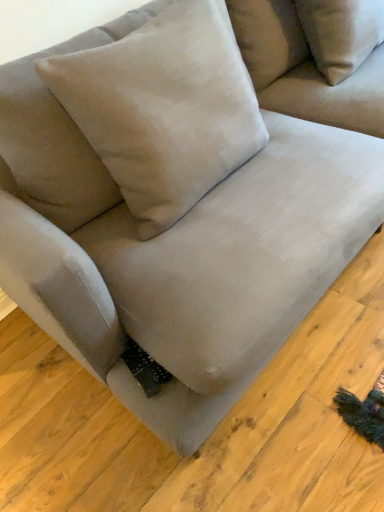
Measure the distance between point (160, 116) and camera.

1.09 meters.

This screenshot has height=512, width=384. What do you see at coordinates (164, 109) in the screenshot?
I see `velvet beige pillow at center` at bounding box center [164, 109].

In order to click on velvet beige pillow at center in this screenshot , I will do `click(164, 109)`.

What is the approximate height of suede-like beige couch at upper right?

17.20 inches.

The image size is (384, 512). What do you see at coordinates (304, 70) in the screenshot? I see `suede-like beige couch at upper right` at bounding box center [304, 70].

Locate an element on the screen. This screenshot has height=512, width=384. suede-like beige couch at upper right is located at coordinates (304, 70).

Find the location of a particular element. velvet beige pillow at center is located at coordinates (164, 109).

Considering the relative positions of suede-like beige couch at upper right and velvet beige pillow at center in the image provided, is suede-like beige couch at upper right to the left or to the right of velvet beige pillow at center?

Clearly, suede-like beige couch at upper right is on the right of velvet beige pillow at center in the image.

Who is more distant, suede-like beige couch at upper right or velvet beige pillow at center?

Positioned behind is suede-like beige couch at upper right.

Between point (314, 71) and point (199, 13), which one is positioned in front?

The point (199, 13) is more forward.

From the image's perspective, between suede-like beige couch at upper right and velvet beige pillow at center, who is located below?

velvet beige pillow at center.

From a real-world perspective, is suede-like beige couch at upper right physically located above or below velvet beige pillow at center?

suede-like beige couch at upper right is below velvet beige pillow at center.

In terms of width, does suede-like beige couch at upper right look wider or thinner when compared to velvet beige pillow at center?

Clearly, suede-like beige couch at upper right has more width compared to velvet beige pillow at center.

Considering the sizes of suede-like beige couch at upper right and velvet beige pillow at center in the image, is suede-like beige couch at upper right taller or shorter than velvet beige pillow at center?

suede-like beige couch at upper right is shorter than velvet beige pillow at center.

Is suede-like beige couch at upper right smaller than velvet beige pillow at center?

Yes, suede-like beige couch at upper right is smaller than velvet beige pillow at center.

Choose the correct answer: Is suede-like beige couch at upper right inside velvet beige pillow at center or outside it?

suede-like beige couch at upper right lies outside velvet beige pillow at center.

Is suede-like beige couch at upper right touching velvet beige pillow at center?

There is a gap between suede-like beige couch at upper right and velvet beige pillow at center.

Is suede-like beige couch at upper right facing away from velvet beige pillow at center?

No, suede-like beige couch at upper right is not facing the opposite direction of velvet beige pillow at center.

In the image, there is a suede-like beige couch at upper right. What are the coordinates of `pillow below it (from the image's perspective)` in the screenshot? It's located at click(x=164, y=109).

Does velvet beige pillow at center appear on the left side of suede-like beige couch at upper right?

Correct, you'll find velvet beige pillow at center to the left of suede-like beige couch at upper right.

Is velvet beige pillow at center behind suede-like beige couch at upper right?

No.

Is point (250, 94) positioned behind point (345, 106)?

No, (250, 94) is in front of (345, 106).

From the image's perspective, which is above, velvet beige pillow at center or suede-like beige couch at upper right?

suede-like beige couch at upper right.

From a real-world perspective, is velvet beige pillow at center located beneath suede-like beige couch at upper right?

No, from a real-world perspective, velvet beige pillow at center is not under suede-like beige couch at upper right.

From the picture: Is velvet beige pillow at center thinner than suede-like beige couch at upper right?

Indeed, velvet beige pillow at center has a lesser width compared to suede-like beige couch at upper right.

From the picture: Is velvet beige pillow at center taller or shorter than suede-like beige couch at upper right?

In the image, velvet beige pillow at center appears to be taller than suede-like beige couch at upper right.

Is velvet beige pillow at center smaller than suede-like beige couch at upper right?

No, velvet beige pillow at center is not smaller than suede-like beige couch at upper right.

Is velvet beige pillow at center inside or outside of suede-like beige couch at upper right?

velvet beige pillow at center is outside suede-like beige couch at upper right.

Is velvet beige pillow at center placed right next to suede-like beige couch at upper right?

No, velvet beige pillow at center is not next to suede-like beige couch at upper right.

Is velvet beige pillow at center oriented away from suede-like beige couch at upper right?

velvet beige pillow at center is not turned away from suede-like beige couch at upper right.

How different are the orientations of velvet beige pillow at center and suede-like beige couch at upper right in degrees?

There is a 0.000442-degree angle between the facing directions of velvet beige pillow at center and suede-like beige couch at upper right.

Image resolution: width=384 pixels, height=512 pixels. I want to click on pillow on the left of suede-like beige couch at upper right, so click(164, 109).

Locate an element on the screen. The width and height of the screenshot is (384, 512). pillow above the suede-like beige couch at upper right (from a real-world perspective) is located at coordinates (164, 109).

This screenshot has width=384, height=512. Find the location of `couch that appears above the velvet beige pillow at center (from the image's perspective)`. couch that appears above the velvet beige pillow at center (from the image's perspective) is located at coordinates (304, 70).